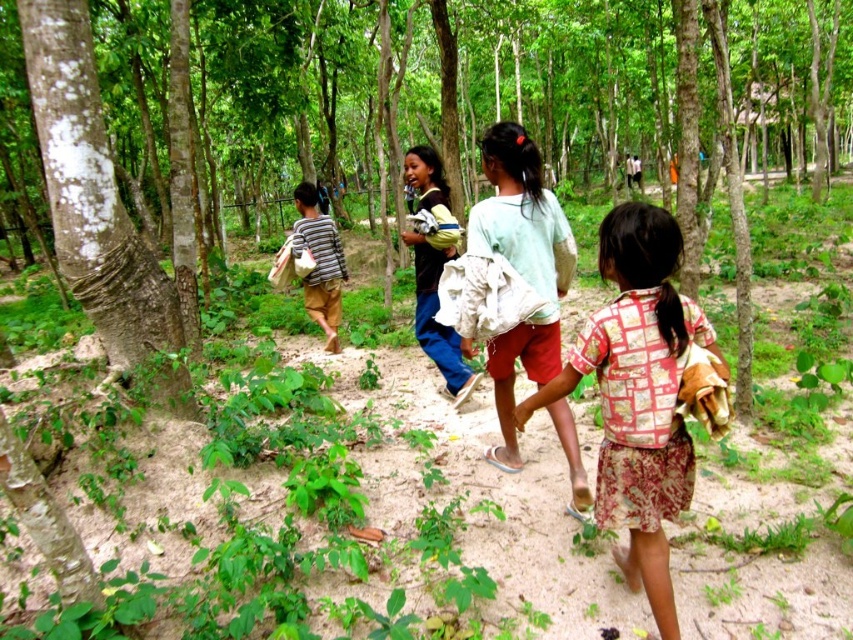
You are navigating through the forest and see two points marked in the image. Which point is closer to you, point [457,355] or point [302,211]?

Point [457,355] is in front of point [302,211], so it is closer to you.

You are a photographer aiming to capture a photo of the striped fabric shirt at center and the green rough bark tree at center. Which object should you focus on first if you want to ensure both are in the frame without moving the camera?

You should focus on the green rough bark tree at center first because it is larger and will require more attention to fit within the frame properly, ensuring the striped fabric shirt at center also remains visible.